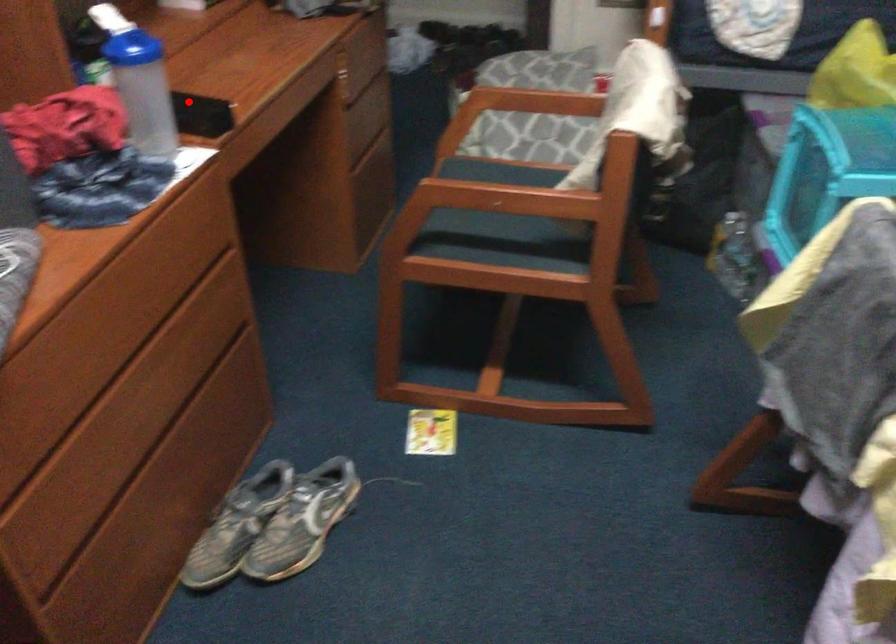
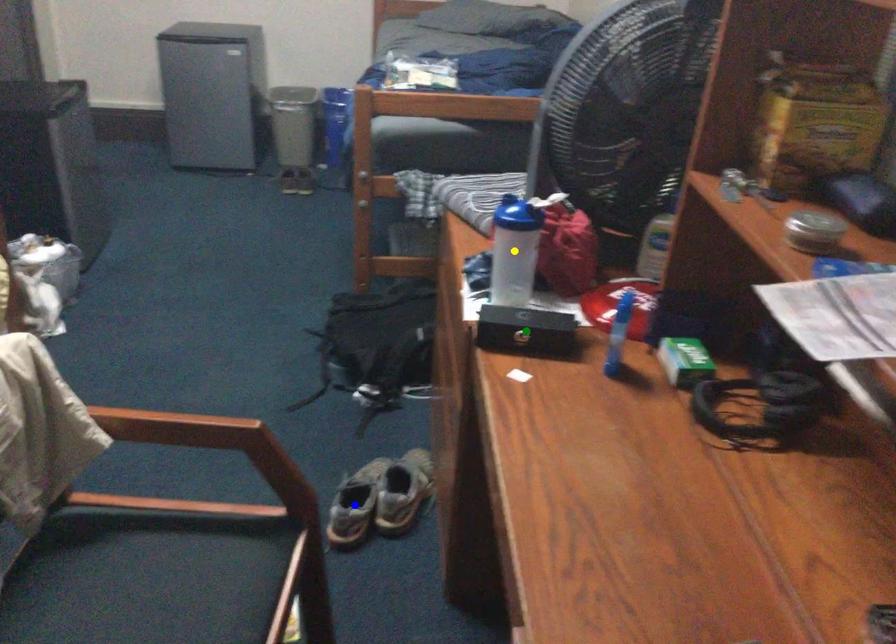
Question: I am providing you with two images of the same scene from different viewpoints. A red point is marked on the first image. You are given multiple points on the second image. In image 2, which mark is for the same physical point as the one in image 1?

Choices:
 (A) yellow point
 (B) blue point
 (C) green point

Answer: (C)